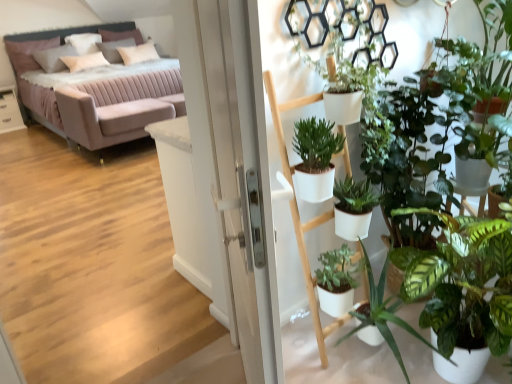
Question: From the image's perspective, is velvet pink couch at upper left located above or below white glossy table at left?

Choices:
 (A) above
 (B) below

Answer: (A)

Question: Considering the relative positions of velvet pink couch at upper left and white glossy table at left in the image provided, is velvet pink couch at upper left to the left or to the right of white glossy table at left?

Choices:
 (A) left
 (B) right

Answer: (B)

Question: Considering the real-world distances, which object is farthest from the white soft pillow at upper left, which is counted as the second pillow, starting from the left?

Choices:
 (A) matte pink pillow at upper left, the fourth pillow positioned from the right
 (B) white soft pillow at upper left, acting as the 2th pillow starting from the right
 (C) white glossy screen door at center
 (D) white soft pillow at upper left, which is the 1th pillow from right to left
 (E) velvet pink couch at upper left

Answer: (C)

Question: Which object is the closest to the velvet pink couch at upper left?

Choices:
 (A) white glossy screen door at center
 (B) white soft pillow at upper left, the third pillow viewed from the left
 (C) white glossy table at left
 (D) white soft pillow at upper left, which is the 1th pillow from right to left
 (E) matte pink pillow at upper left, acting as the 1th pillow starting from the left

Answer: (D)